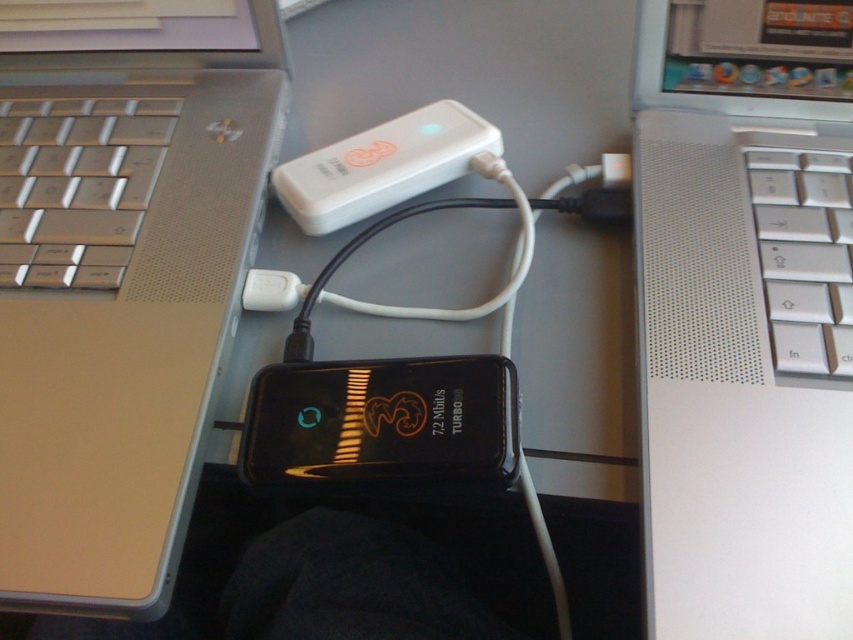
Question: Considering the real-world distances, which object is closest to the silver metallic laptop at center-right?

Choices:
 (A) silver metallic keyboard at right
 (B) silver metallic laptop at center
 (C) black glossy smartphone at center
 (D) white matte usb device at center

Answer: (A)

Question: Is black glossy smartphone at center above white matte usb device at center?

Choices:
 (A) yes
 (B) no

Answer: (B)

Question: Is silver metallic keyboard at right above white matte usb device at center?

Choices:
 (A) no
 (B) yes

Answer: (A)

Question: Which object is the closest to the silver metallic laptop at center-right?

Choices:
 (A) white matte usb device at center
 (B) silver metallic keyboard at right

Answer: (B)

Question: Does silver metallic keyboard at right have a smaller size compared to white matte usb device at center?

Choices:
 (A) yes
 (B) no

Answer: (A)

Question: Which object appears closest to the camera in this image?

Choices:
 (A) silver metallic laptop at center
 (B) white matte usb device at center
 (C) silver metallic laptop at center-right
 (D) black glossy smartphone at center

Answer: (C)